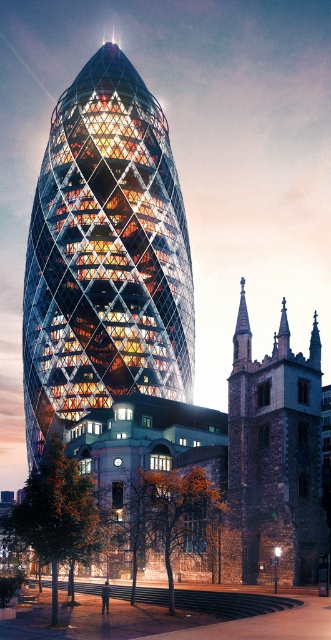
Question: Is glassy orange building at center bigger than dark brown stone tower at lower right?

Choices:
 (A) yes
 (B) no

Answer: (A)

Question: Does glassy orange building at center appear over dark brown stone tower at lower right?

Choices:
 (A) no
 (B) yes

Answer: (B)

Question: In this image, where is glassy orange building at center located relative to dark brown stone tower at lower right?

Choices:
 (A) above
 (B) below

Answer: (A)